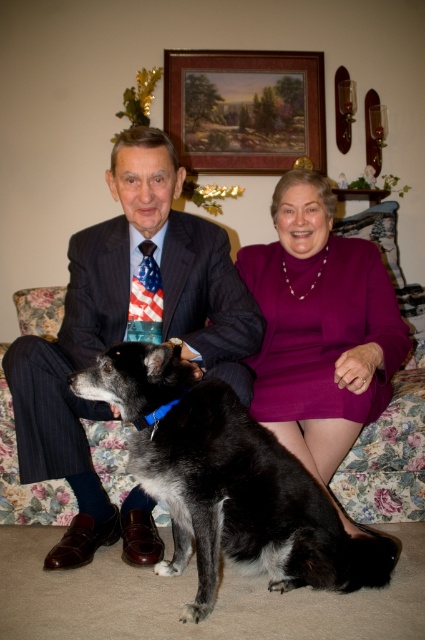
Can you confirm if black fur dog at center is thinner than purple satin dress at center?

In fact, black fur dog at center might be wider than purple satin dress at center.

Who is lower down, black fur dog at center or purple satin dress at center?

black fur dog at center is lower down.

What do you see at coordinates (227, 483) in the screenshot? I see `black fur dog at center` at bounding box center [227, 483].

Identify the location of black fur dog at center. This screenshot has height=640, width=425. (227, 483).

Who is higher up, purple satin dress at center or wooden framed painting at upper center?

Positioned higher is wooden framed painting at upper center.

In order to click on purple satin dress at center in this screenshot , I will do `click(320, 330)`.

Identify the location of purple satin dress at center. The image size is (425, 640). (320, 330).

Is point (144, 308) positioned in front of point (288, 109)?

That is True.

Who is more forward, (x=53, y=406) or (x=306, y=93)?

Positioned in front is point (x=53, y=406).

I want to click on matte black dress at center, so click(x=125, y=337).